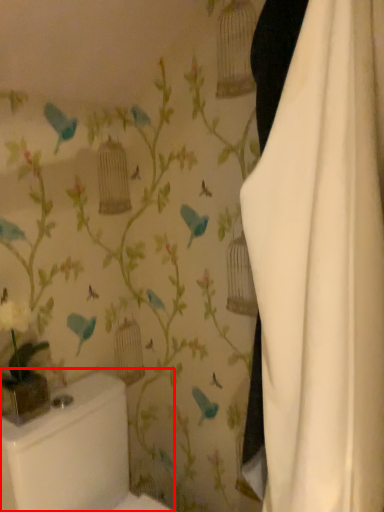
Question: Where is toilet bowl (annotated by the red box) located in relation to curtain in the image?

Choices:
 (A) left
 (B) right

Answer: (A)